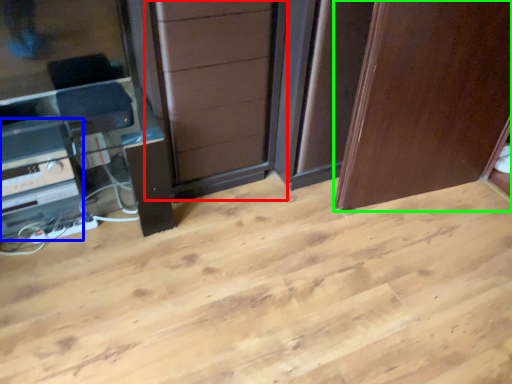
Question: Which object is positioned closest to screen door (highlighted by a red box)? Select from appliance (highlighted by a blue box) and door (highlighted by a green box).

Choices:
 (A) appliance
 (B) door

Answer: (B)